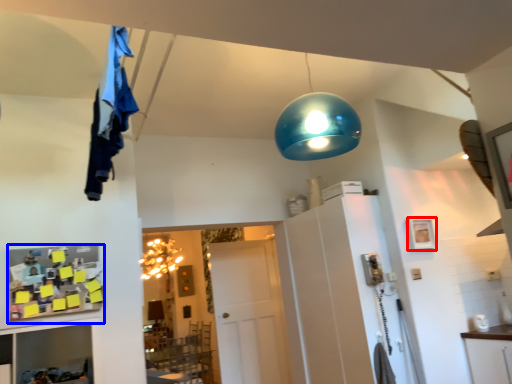
Question: Which object is closer to the camera taking this photo, picture frame (highlighted by a red box) or shelf (highlighted by a blue box)?

Choices:
 (A) picture frame
 (B) shelf

Answer: (B)